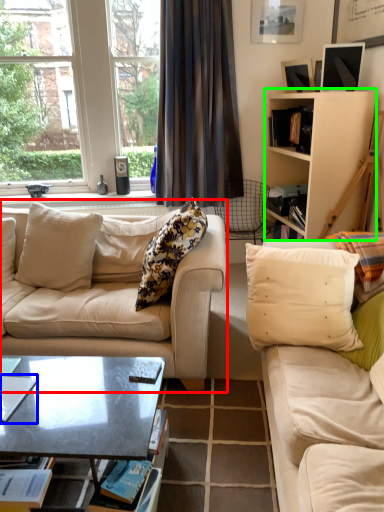
Question: Which object is the farthest from studio couch (highlighted by a red box)? Choose among these: magazine (highlighted by a blue box) or cabinetry (highlighted by a green box).

Choices:
 (A) magazine
 (B) cabinetry

Answer: (B)